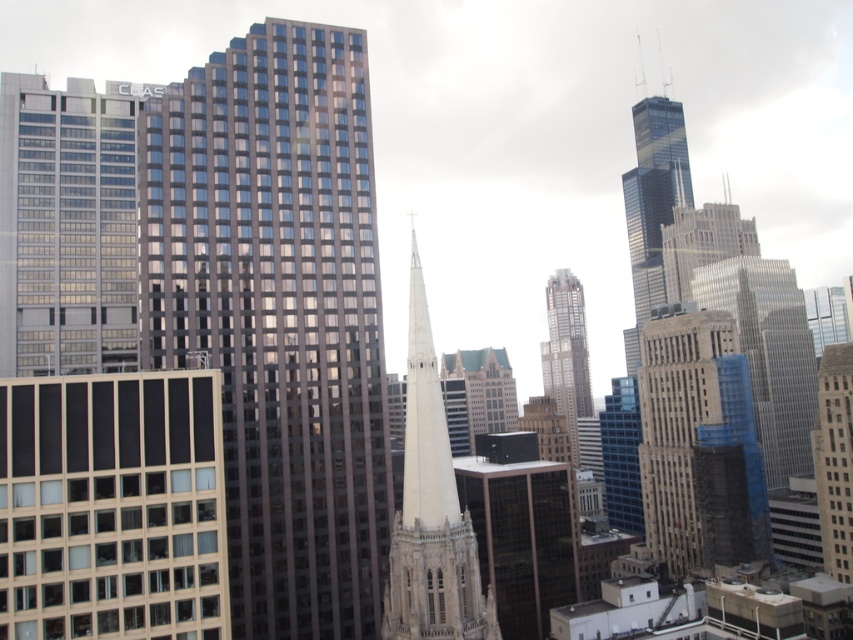
You are a drone operator who needs to fly a drone between the dark glass skyscraper at center and the brown stone tower at right. The drone has a maximum flight distance of 60 meters. Can the drone safely make the trip between these two buildings without exceeding its limit?

The dark glass skyscraper at center and brown stone tower at right are 59.69 meters apart from each other. Since the distance is less than the drone maximum flight distance of 60 meters, the drone can safely make the trip between these two buildings without exceeding its limit.